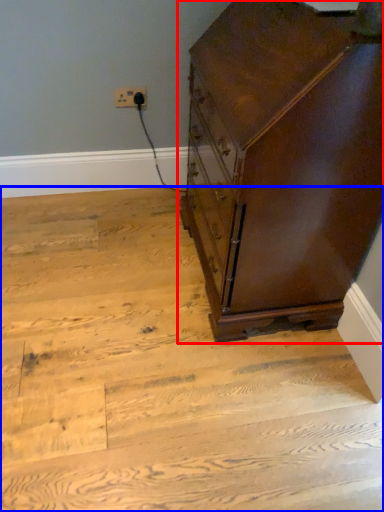
Question: Among these objects, which one is farthest to the camera, chest of drawers (highlighted by a red box) or stairwell (highlighted by a blue box)?

Choices:
 (A) chest of drawers
 (B) stairwell

Answer: (B)